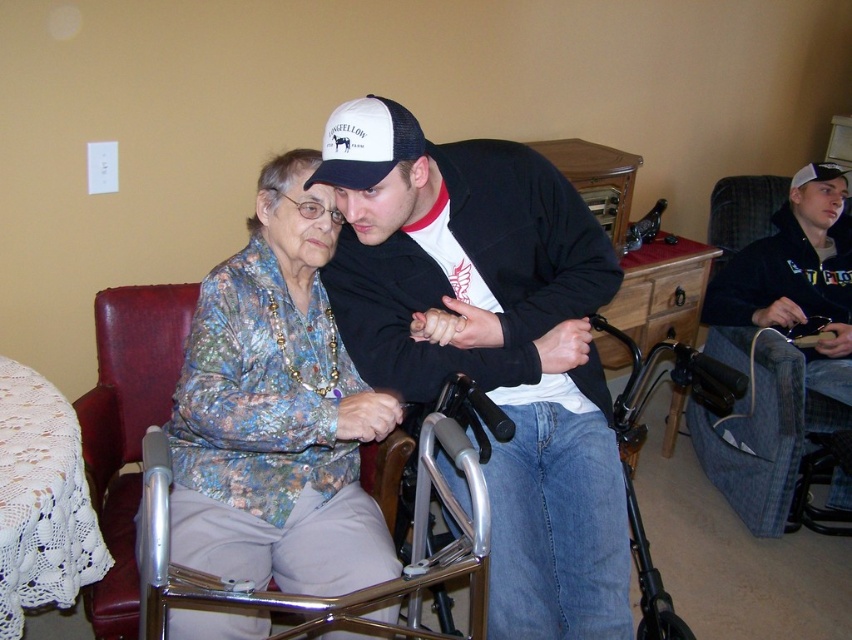
Is matte black jacket at center wider than white mesh baseball cap at upper center?

Yes.

Looking at this image, does matte black jacket at center have a lesser height compared to white mesh baseball cap at upper center?

In fact, matte black jacket at center may be taller than white mesh baseball cap at upper center.

Does point (568, 260) come behind point (341, 108)?

Yes, point (568, 260) is farther from viewer.

In order to click on matte black jacket at center in this screenshot , I will do `click(491, 344)`.

Where is `floral fabric blouse at center`? floral fabric blouse at center is located at coordinates click(x=275, y=412).

Who is more distant from viewer, (x=210, y=554) or (x=751, y=292)?

The point (x=751, y=292) is behind.

Find the location of a particular element. floral fabric blouse at center is located at coordinates (275, 412).

Between floral fabric blouse at center and white mesh baseball cap at upper center, which one has more height?

floral fabric blouse at center

The width and height of the screenshot is (852, 640). What do you see at coordinates (275, 412) in the screenshot?
I see `floral fabric blouse at center` at bounding box center [275, 412].

You are a GUI agent. You are given a task and a screenshot of the screen. Output one action in this format:
    pyautogui.click(x=<x>, y=<y>)
    Task: Click on the floral fabric blouse at center
    
    Given the screenshot: What is the action you would take?
    pyautogui.click(x=275, y=412)